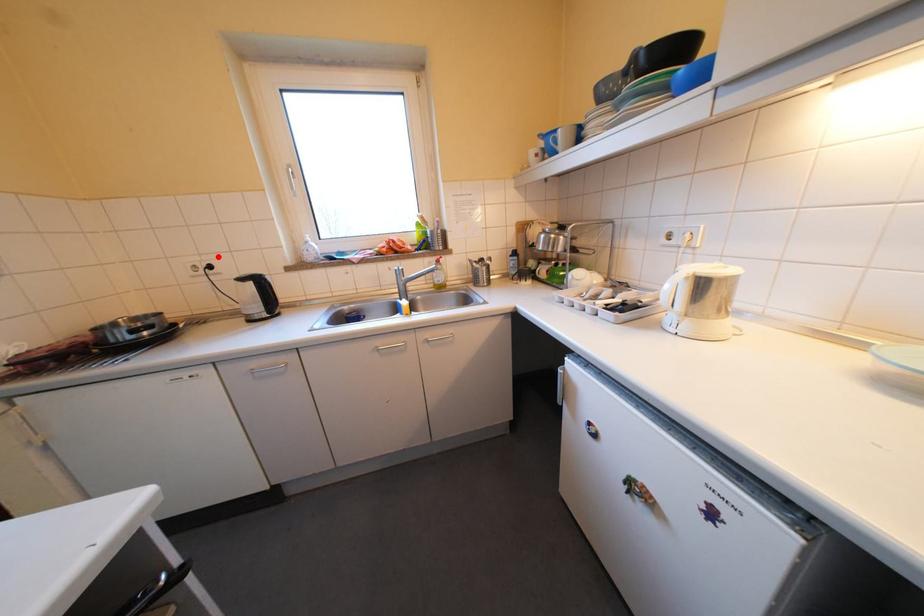
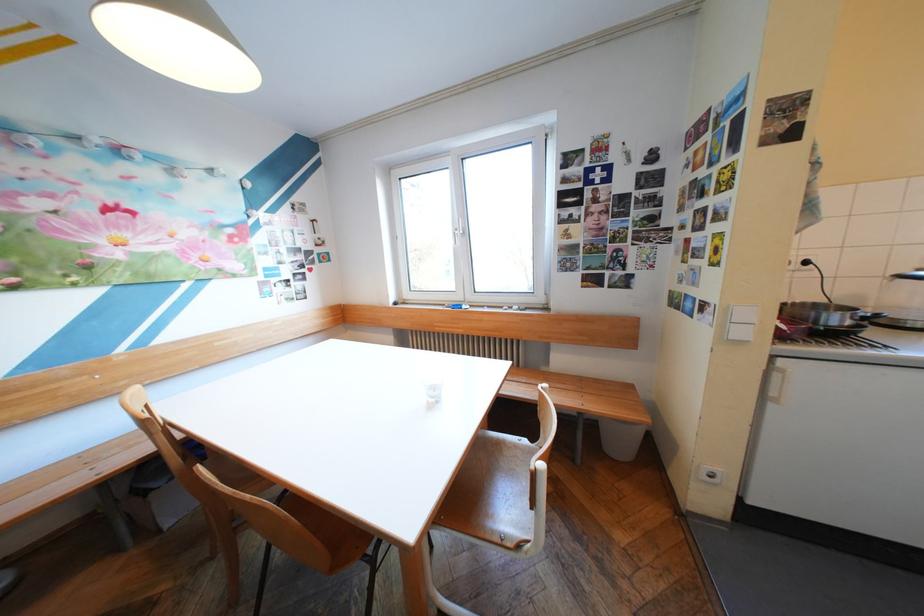
Locate, in the second image, the point that corresponds to the highlighted location in the first image.

(816, 252)